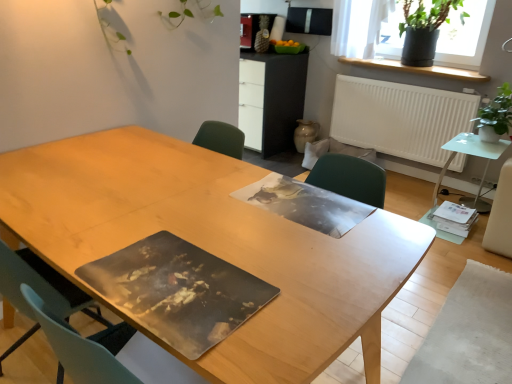
Question: Is green leafy plant at right, acting as the first houseplant starting from the bottom, facing away from green matte plant pot at upper right?

Choices:
 (A) yes
 (B) no

Answer: (B)

Question: Is green leafy plant at right, acting as the first houseplant starting from the bottom, positioned far away from green matte plant pot at upper right?

Choices:
 (A) yes
 (B) no

Answer: (B)

Question: Does green leafy plant at right, which is the second houseplant in top-to-bottom order, have a lesser width compared to green matte plant pot at upper right?

Choices:
 (A) yes
 (B) no

Answer: (B)

Question: Is green leafy plant at right, acting as the first houseplant starting from the bottom, outside of green matte plant pot at upper right?

Choices:
 (A) yes
 (B) no

Answer: (A)

Question: Considering the relative sizes of green leafy plant at right, the 1th houseplant when ordered from front to back, and green matte plant pot at upper right in the image provided, is green leafy plant at right, the 1th houseplant when ordered from front to back, taller than green matte plant pot at upper right?

Choices:
 (A) no
 (B) yes

Answer: (A)

Question: In terms of size, does green matte plant pot at upper right appear bigger or smaller than white matte radiator at upper right?

Choices:
 (A) small
 (B) big

Answer: (B)

Question: Is green matte plant pot at upper right situated inside white matte radiator at upper right or outside?

Choices:
 (A) outside
 (B) inside

Answer: (A)

Question: Is green matte plant pot at upper right taller or shorter than white matte radiator at upper right?

Choices:
 (A) short
 (B) tall

Answer: (A)

Question: Visually, is green matte plant pot at upper right positioned to the left or to the right of white matte radiator at upper right?

Choices:
 (A) right
 (B) left

Answer: (B)

Question: From the image's perspective, is wooden table at center, the second table in the back-to-front sequence, above or below matte black cabinet at center?

Choices:
 (A) below
 (B) above

Answer: (A)

Question: Is wooden table at center, the 1th table positioned from the left, wider or thinner than matte black cabinet at center?

Choices:
 (A) wide
 (B) thin

Answer: (A)

Question: Is wooden table at center, marked as the first table in a front-to-back arrangement, inside the boundaries of matte black cabinet at center, or outside?

Choices:
 (A) inside
 (B) outside

Answer: (B)

Question: Is wooden table at center, the 2th table viewed from the right, taller or shorter than matte black cabinet at center?

Choices:
 (A) tall
 (B) short

Answer: (B)

Question: Is point (479, 196) positioned closer to the camera than point (265, 54)?

Choices:
 (A) closer
 (B) farther

Answer: (A)

Question: Is translucent glass side table at right, the 2th table viewed from the left, in front of or behind matte black cabinet at center in the image?

Choices:
 (A) front
 (B) behind

Answer: (A)